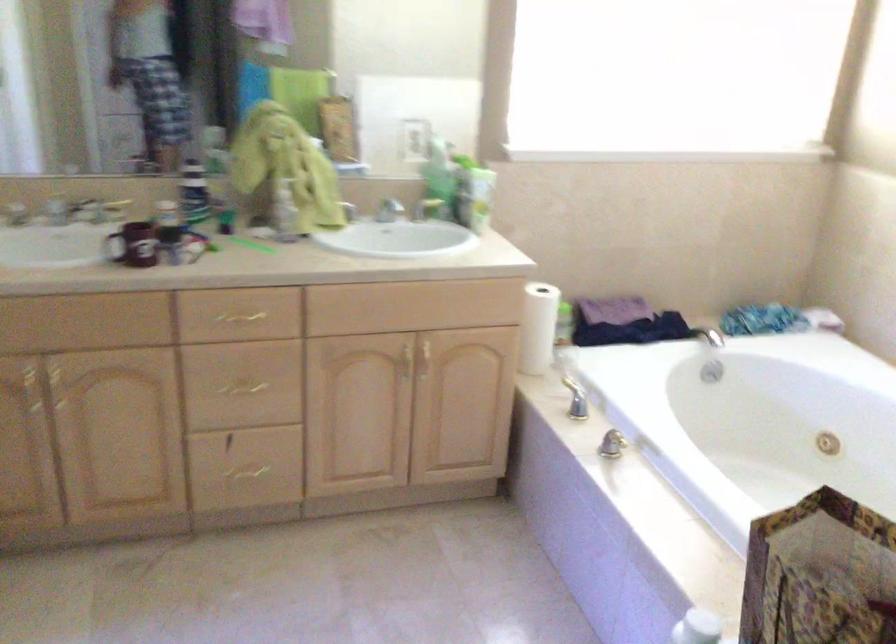
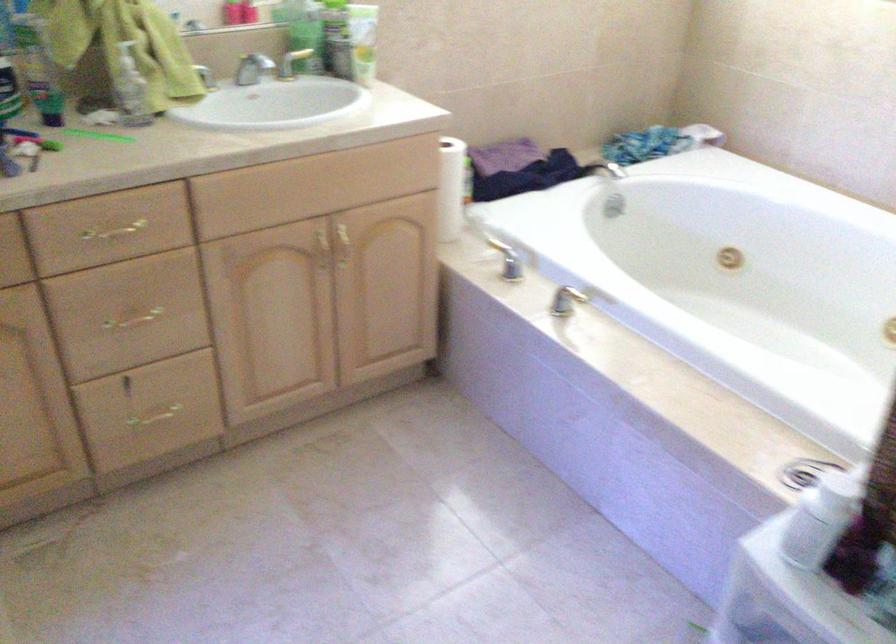
Where in the second image is the point corresponding to point 426,359 from the first image?

(342, 245)